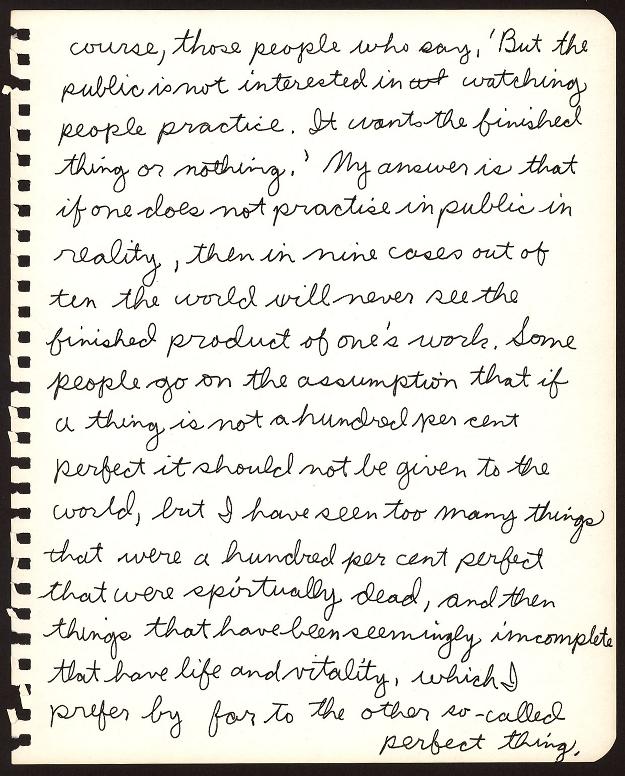
Image resolution: width=625 pixels, height=776 pixels. Find the location of `rounded corners`. rounded corners is located at coordinates point(605,746), point(604,33).